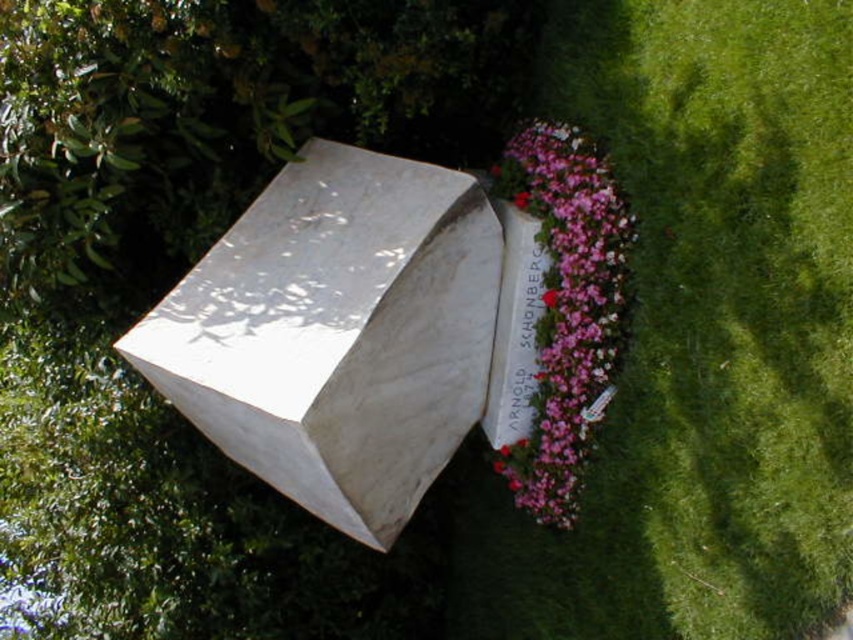
You are a visitor at the monument and want to take a photo of both the white marble box at center and the pink floral bouquet at center. Which object should you focus on first to ensure both are in the frame?

You should focus on the white marble box at center first because it is positioned under the pink floral bouquet at center, so adjusting the camera angle to include both would require framing from the lower object upwards.

You are a gardener who needs to water the pink floral bouquet at center and the green grass at lower right. Based on their positions, which area should you water first to avoid wetting the monument?

The green grass at lower right is below the pink floral bouquet at center. Since the grass is lower, watering the pink floral bouquet at center first would cause water to potentially drip down onto the monument. Therefore, you should water the green grass at lower right first to avoid wetting the monument.

Based on the photo, you are standing in front of the monument and want to place a small flag on the green grass at lower right. If your arm can reach 2 meters, can you place the flag without moving from your current position?

The green grass at lower right is 3.01 meters from camera, which is beyond your arm reach of 2 meters. You need to move closer to place the flag.